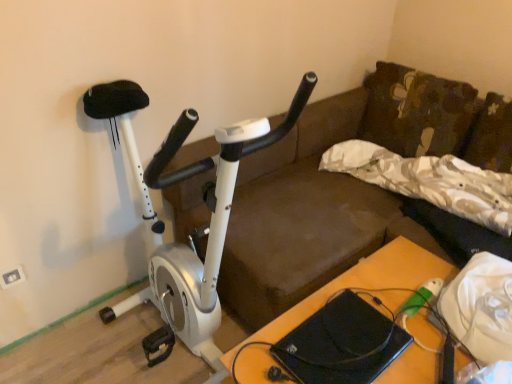
Question: From the image's perspective, is white metallic stationary bicycle at left above or below white plastic electric outlet at upper left?

Choices:
 (A) above
 (B) below

Answer: (A)

Question: Relative to white plastic electric outlet at upper left, is white metallic stationary bicycle at left in front or behind?

Choices:
 (A) behind
 (B) front

Answer: (B)

Question: Estimate the real-world distances between objects in this image. Which object is farther from the white plastic electric outlet at upper left?

Choices:
 (A) wooden table at lower right
 (B) camouflage fabric pillow at center
 (C) white metallic stationary bicycle at left

Answer: (B)

Question: Which of these objects is positioned closest to the wooden table at lower right?

Choices:
 (A) white metallic stationary bicycle at left
 (B) white plastic electric outlet at upper left
 (C) camouflage fabric pillow at center

Answer: (C)